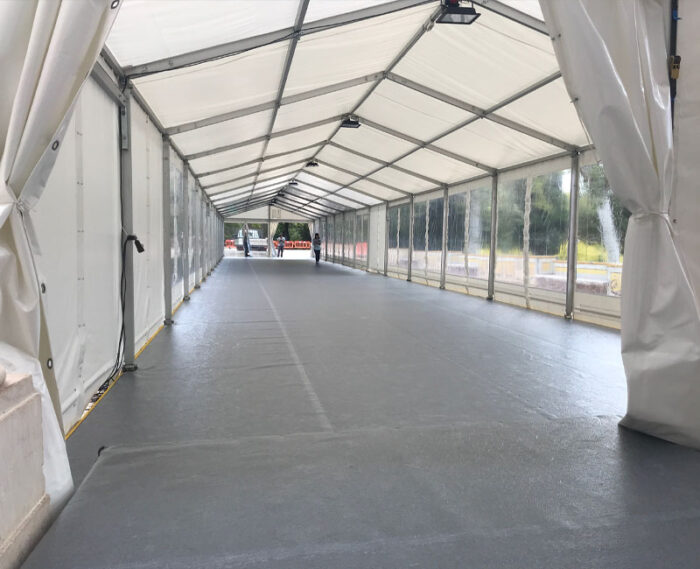
This screenshot has height=569, width=700. In order to click on rafter support beams in this screenshot , I will do `click(491, 109)`, `click(399, 56)`, `click(288, 61)`.